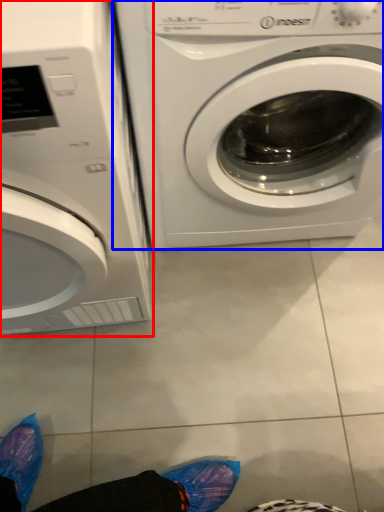
Question: Which object appears farthest to the camera in this image, washing machine (highlighted by a red box) or washing machine (highlighted by a blue box)?

Choices:
 (A) washing machine
 (B) washing machine

Answer: (B)